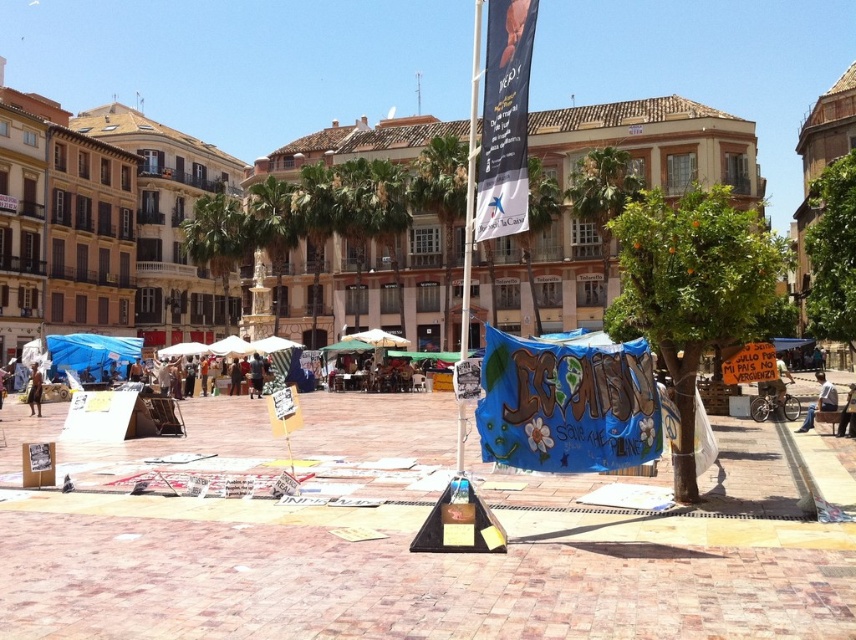
Question: Can you confirm if blue fabric banner at center is positioned to the left of brown fabric tent at center?

Choices:
 (A) no
 (B) yes

Answer: (A)

Question: Which object is positioned farthest from the dark brown skin at lower left?

Choices:
 (A) white fabric banner at center
 (B) brown fabric tent at center
 (C) denim jeans at lower right
 (D) blue fabric banner at center

Answer: (C)

Question: Is blue fabric banner at center wider than brown fabric tent at center?

Choices:
 (A) yes
 (B) no

Answer: (A)

Question: Among these objects, which one is nearest to the camera?

Choices:
 (A) denim jeans at lower right
 (B) blue fabric banner at center
 (C) white fabric banner at center

Answer: (C)

Question: Is blue fabric banner at center below dark brown skin at lower left?

Choices:
 (A) yes
 (B) no

Answer: (B)

Question: Which of these objects is positioned farthest from the denim jeans at lower right?

Choices:
 (A) dark brown skin at lower left
 (B) white fabric banner at center
 (C) blue fabric banner at center
 (D) brown fabric tent at center

Answer: (A)